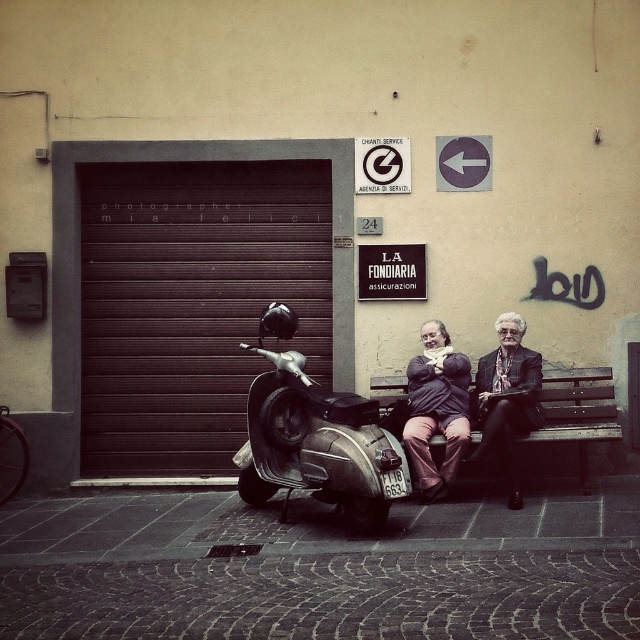
From the picture: You are standing in front of the closed metal garage door with horizontal slats on the left side of the frame. You notice two points marked in the scene. The first point is at coordinates point (280, 522), and the second is at point (522, 330). Which of these points is closer to you?

Point (280, 522) is closer to you because it is in front of point (522, 330).

You are a delivery person who needs to load a package onto the shiny metallic scooter at center. The package is too large to carry while holding the matte black coat at center. Can you place the coat on the scooter without it falling off, considering their distance apart?

The shiny metallic scooter at center and matte black coat at center are 3.88 feet apart from each other. Since the distance is manageable, you can safely place the coat on the scooter without it falling off.

You are standing in front of the garage door and want to locate two points marked on the wall. According to the coordinates provided, which point is closer to you, point at (484, 404) or point at (476, 428)?

Point at (484, 404) is in front of point at (476, 428), so it is closer to you.